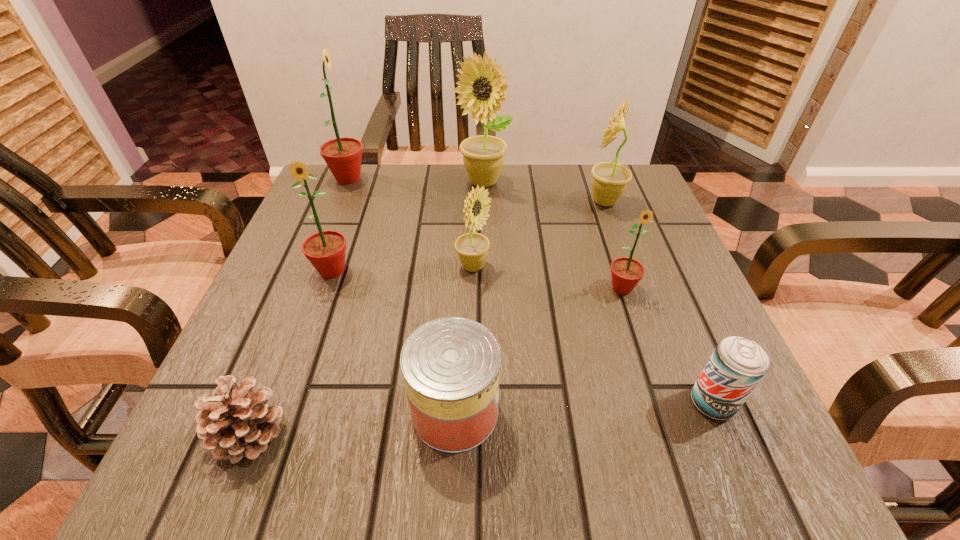
The width and height of the screenshot is (960, 540). I want to click on free space between the beer can and the biggest yellow sunflower, so click(597, 293).

I want to click on object identified as the fifth closest to the smallest yellow sunflower, so [609, 180].

I want to click on the sixth closest object to the beer can, so click(x=237, y=422).

Select which sunflower is the second closest to the second smallest yellow sunflower. Please provide its 2D coordinates. Your answer should be formatted as a tuple, i.e. [(x, y)], where the tuple contains the x and y coordinates of a point satisfying the conditions above.

[(626, 272)]

The height and width of the screenshot is (540, 960). Find the location of `sunflower object that ranks as the fourth closest to the can`. sunflower object that ranks as the fourth closest to the can is located at coordinates (609, 180).

Identify which green sunflower is located as the nearest to the biggest green sunflower. Please provide its 2D coordinates. Your answer should be formatted as a tuple, i.e. [(x, y)], where the tuple contains the x and y coordinates of a point satisfying the conditions above.

[(325, 250)]

Select which green sunflower appears as the closest to the biggest yellow sunflower. Please provide its 2D coordinates. Your answer should be formatted as a tuple, i.e. [(x, y)], where the tuple contains the x and y coordinates of a point satisfying the conditions above.

[(343, 156)]

Identify which yellow sunflower is the second nearest to the can. Please provide its 2D coordinates. Your answer should be formatted as a tuple, i.e. [(x, y)], where the tuple contains the x and y coordinates of a point satisfying the conditions above.

[(609, 180)]

Where is `the second closest yellow sunflower to the second smallest green sunflower`? The image size is (960, 540). the second closest yellow sunflower to the second smallest green sunflower is located at coordinates (481, 80).

You are a GUI agent. You are given a task and a screenshot of the screen. Output one action in this format:
    pyautogui.click(x=<x>, y=<y>)
    Task: Click on the vacant space that satisfies the following two spatial constraints: 1. on the face of the second biggest yellow sunflower; 2. on the front side of the brown pinecone
    The height and width of the screenshot is (540, 960).
    Given the screenshot: What is the action you would take?
    pyautogui.click(x=686, y=433)